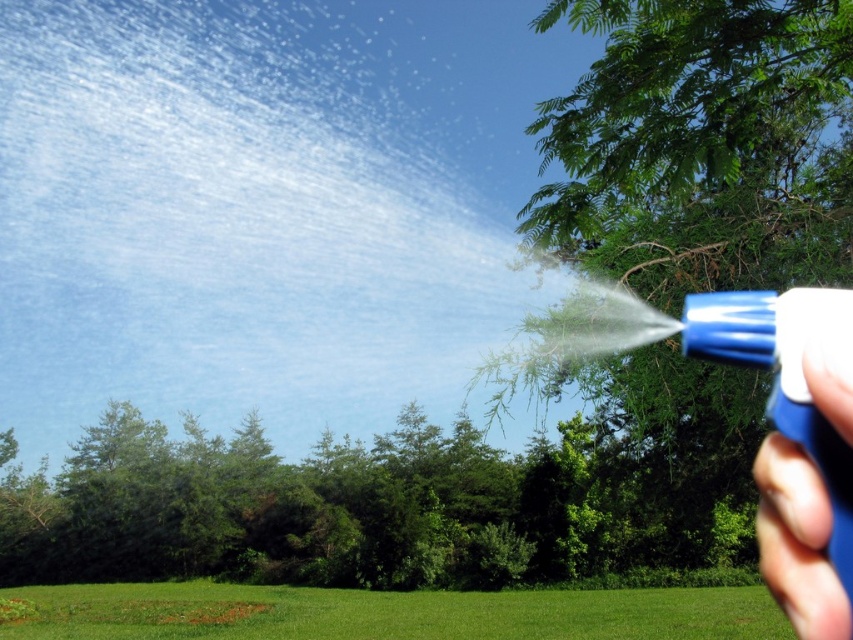
Which of these two, green leafy tree at upper right or blue plastic spray nozzle at lower right, stands shorter?

Standing shorter between the two is blue plastic spray nozzle at lower right.

Between green leafy tree at upper right and blue plastic spray nozzle at lower right, which one appears on the left side from the viewer's perspective?

Positioned to the left is blue plastic spray nozzle at lower right.

At what (x,y) coordinates should I click in order to perform the action: click on green leafy tree at upper right. Please return your answer as a coordinate pair (x, y). This screenshot has height=640, width=853. Looking at the image, I should click on (699, 147).

Identify the location of green leafy tree at upper right. This screenshot has width=853, height=640. (699, 147).